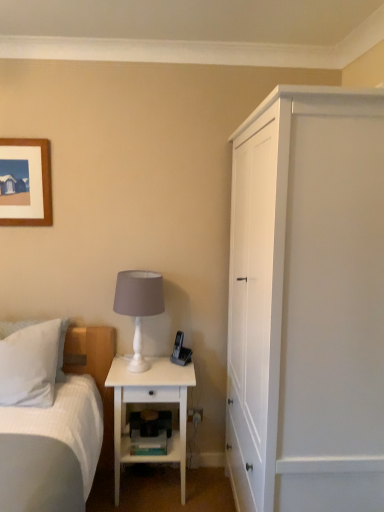
What are the coordinates of `free space above white matte table lamp at center (from a real-world perspective)` in the screenshot? It's located at (135, 272).